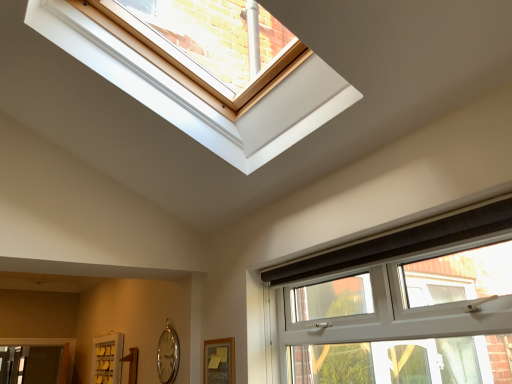
Question: From the image's perspective, relative to white plastic window at lower right, is silver metallic clock at lower left above or below?

Choices:
 (A) below
 (B) above

Answer: (A)

Question: Relative to white plastic window at lower right, is silver metallic clock at lower left in front or behind?

Choices:
 (A) behind
 (B) front

Answer: (A)

Question: Which object is the closest to the silver metallic clock at lower left?

Choices:
 (A) white matte screen door at lower left
 (B) white plastic window at lower right

Answer: (A)

Question: Which object is positioned farthest from the white plastic window at lower right?

Choices:
 (A) silver metallic clock at lower left
 (B) white matte screen door at lower left

Answer: (B)